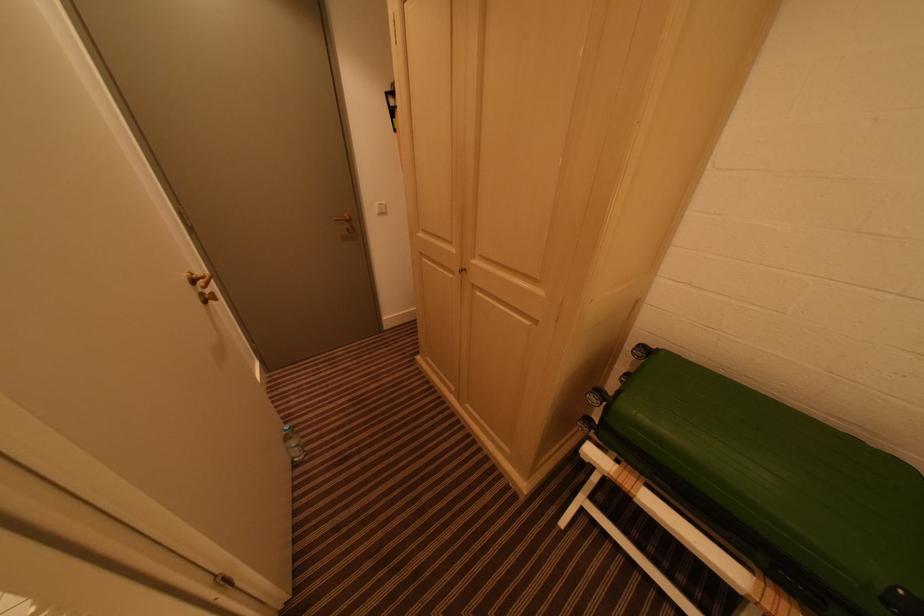
Where would you pull the wardrobe door knob? Please return your answer as a coordinate pair (x, y).

(462, 270)